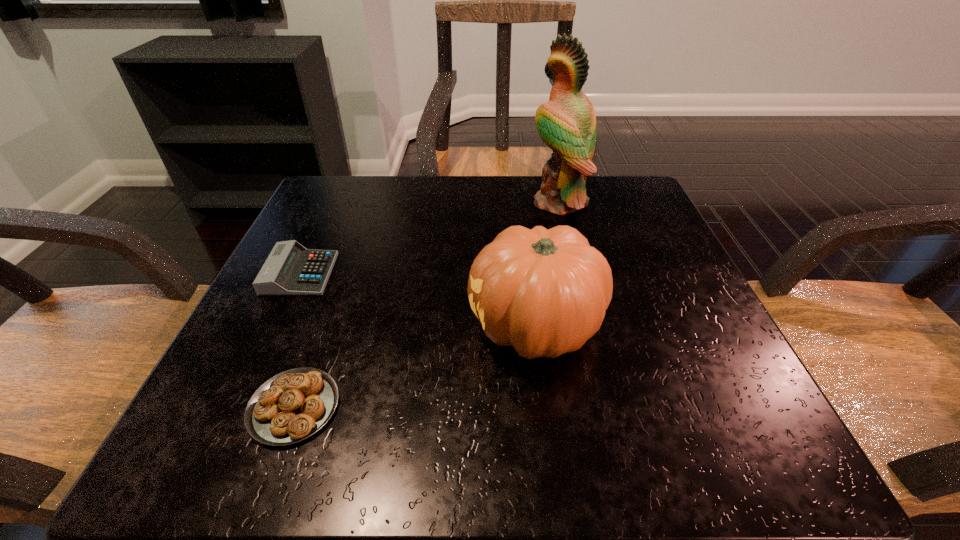
In order to click on parrot in this screenshot , I will do `click(567, 123)`.

Find the location of `the tallest object`. the tallest object is located at coordinates (567, 123).

At what (x,y) coordinates should I click in order to perform the action: click on pumpkin. Please return your answer as a coordinate pair (x, y). The image size is (960, 540). Looking at the image, I should click on (544, 291).

The height and width of the screenshot is (540, 960). In order to click on calculator in this screenshot , I will do `click(290, 269)`.

Image resolution: width=960 pixels, height=540 pixels. I want to click on pastry, so click(x=293, y=405).

Locate an element on the screen. vacant space situated on the front-facing side of the farthest object is located at coordinates (438, 202).

Locate an element on the screen. This screenshot has height=540, width=960. vacant position located on the front-facing side of the farthest object is located at coordinates (415, 202).

Identify the location of vacant space located on the front-facing side of the farthest object. (396, 202).

The image size is (960, 540). I want to click on free spot located 0.330m on the carved face of the pumpkin, so click(x=256, y=327).

Where is `free location located on the carved face of the pumpkin`? Image resolution: width=960 pixels, height=540 pixels. free location located on the carved face of the pumpkin is located at coordinates (340, 327).